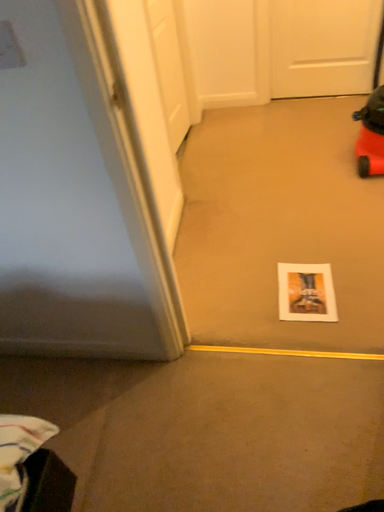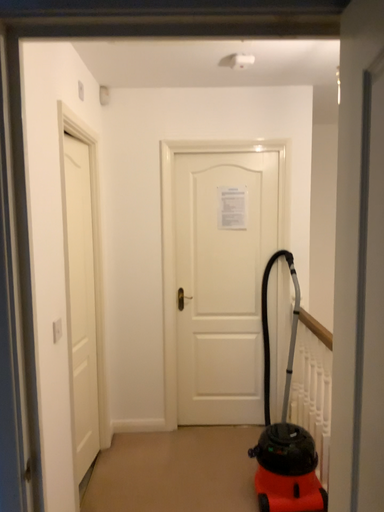
Question: Which way did the camera rotate in the video?

Choices:
 (A) rotated right
 (B) rotated left

Answer: (A)